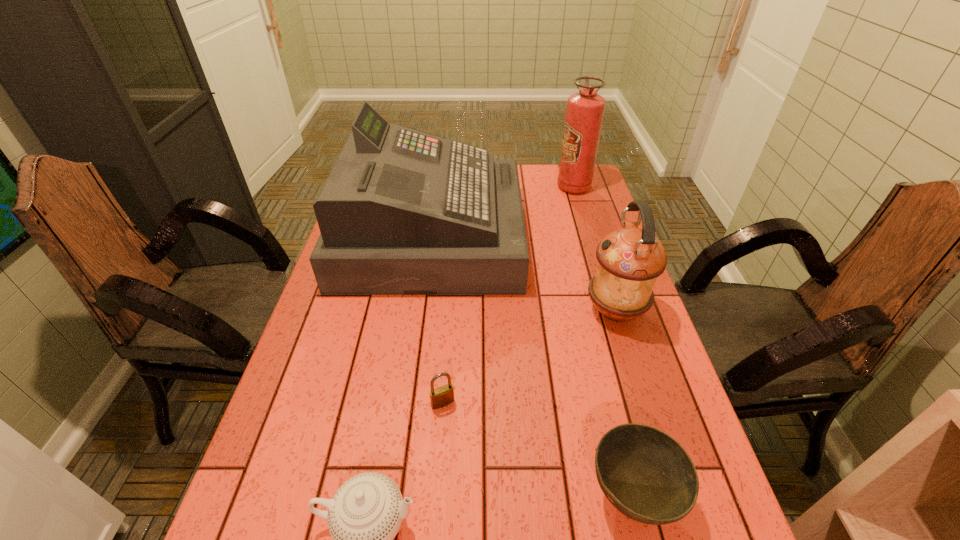
This screenshot has width=960, height=540. In order to click on fire extinguisher in this screenshot , I will do point(585,110).

Locate an element on the screen. The image size is (960, 540). cash register is located at coordinates (402, 212).

Identify the location of oil lamp. This screenshot has height=540, width=960. (630, 259).

Identify the location of padlock. (440, 397).

You are a GUI agent. You are given a task and a screenshot of the screen. Output one action in this format:
    pyautogui.click(x=<x>, y=<y>)
    Task: Click on the free location located 0.140m on the label side of the fire extinguisher
    The image size is (960, 540).
    Given the screenshot: What is the action you would take?
    pyautogui.click(x=519, y=187)

Where is `vacant space positioned 0.350m on the label side of the fire extinguisher`? The height and width of the screenshot is (540, 960). vacant space positioned 0.350m on the label side of the fire extinguisher is located at coordinates (464, 187).

Where is `free space located 0.340m on the label side of the fire extinguisher`? free space located 0.340m on the label side of the fire extinguisher is located at coordinates 467,187.

Image resolution: width=960 pixels, height=540 pixels. Find the location of `free space located 0.310m on the front-facing side of the cash register`. free space located 0.310m on the front-facing side of the cash register is located at coordinates (614, 237).

Identify the location of free space located on the front of the oil lamp. This screenshot has width=960, height=540. (665, 470).

What are the coordinates of `vacant space located on the back of the padlock` in the screenshot? It's located at (451, 289).